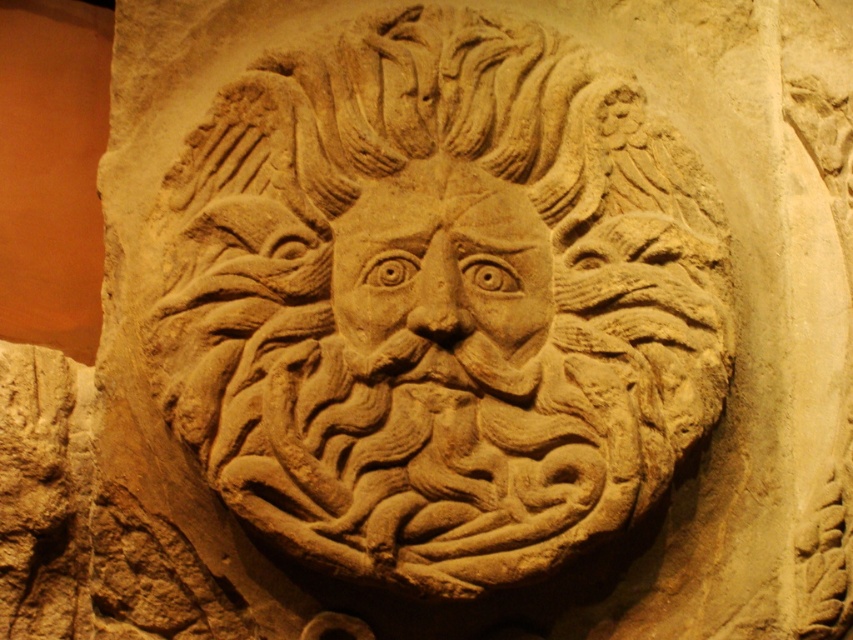
Does beige stone carving at center appear over beige stone face at center?

Yes.

Is beige stone carving at center positioned behind beige stone face at center?

That is False.

The height and width of the screenshot is (640, 853). In order to click on beige stone carving at center in this screenshot , I will do [x=438, y=300].

Where is `beige stone carving at center`? The width and height of the screenshot is (853, 640). beige stone carving at center is located at coordinates (438, 300).